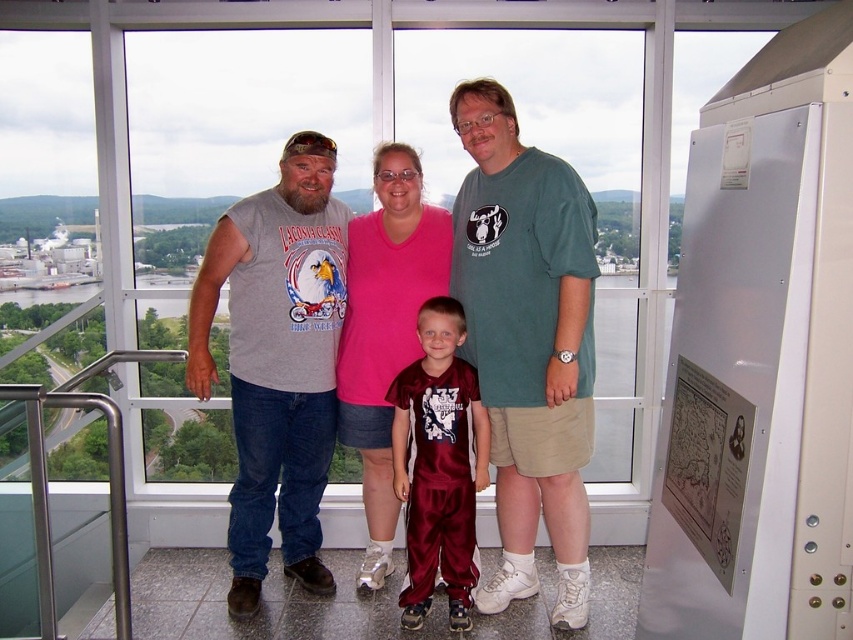
You are a photographer trying to capture a photo of the gray sleeveless shirt at center and the maroon jersey at center. Which one is positioned lower in the image?

The gray sleeveless shirt at center is located below the maroon jersey at center, so it is positioned lower in the image.